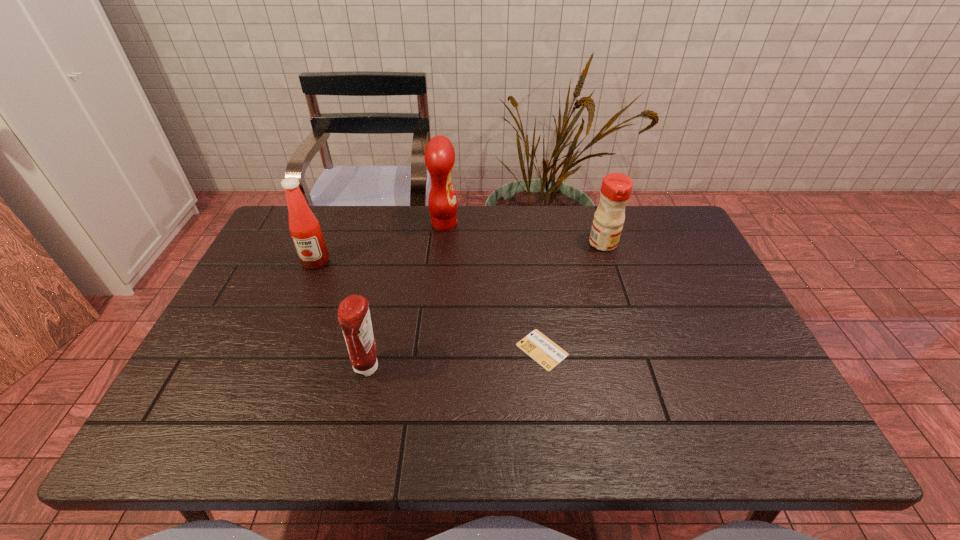
Find the location of a particular element. free point located 0.240m on the right of the rightmost condiment is located at coordinates (695, 244).

This screenshot has width=960, height=540. In order to click on blank space located 0.160m on the left of the third condiment from right to left in this screenshot , I will do `click(285, 368)`.

You are a GUI agent. You are given a task and a screenshot of the screen. Output one action in this format:
    pyautogui.click(x=<x>, y=<y>)
    Task: Click on the vacant area situated on the back of the shortest object
    The height and width of the screenshot is (540, 960).
    Given the screenshot: What is the action you would take?
    pyautogui.click(x=531, y=265)

The image size is (960, 540). What are the coordinates of `object present at the left edge` in the screenshot? It's located at pos(305,230).

Where is `vacant space at the far edge`? This screenshot has height=540, width=960. vacant space at the far edge is located at coordinates (562, 216).

Image resolution: width=960 pixels, height=540 pixels. In the image, there is a desktop. Find the location of `blank space at the near edge`. blank space at the near edge is located at coordinates (671, 435).

The image size is (960, 540). In order to click on vacant space at the left edge in this screenshot , I will do `click(227, 375)`.

Identify the location of vacant position at the right edge of the desktop. tap(779, 401).

In the image, there is a desktop. Find the location of `vacant region at the near left corner`. vacant region at the near left corner is located at coordinates (179, 434).

This screenshot has height=540, width=960. What are the coordinates of `empty location between the third object from left to right and the rightmost object` in the screenshot? It's located at (524, 233).